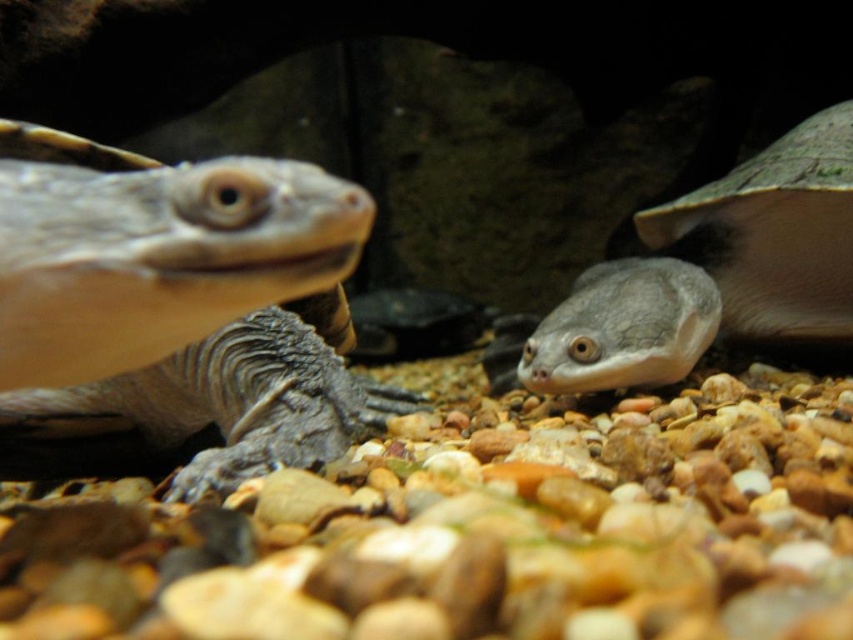
Question: Which object is positioned farthest from the smooth brown tortoise at left?

Choices:
 (A) smooth gray tortoise at center
 (B) matte gray tortoise at right

Answer: (B)

Question: Can you confirm if matte gray tortoise at right is positioned to the left of smooth gray tortoise at center?

Choices:
 (A) yes
 (B) no

Answer: (B)

Question: Which of the following is the farthest from the observer?

Choices:
 (A) smooth gray tortoise at center
 (B) matte gray tortoise at right

Answer: (B)

Question: Does smooth brown tortoise at left have a lesser width compared to matte gray tortoise at right?

Choices:
 (A) yes
 (B) no

Answer: (A)

Question: Is smooth brown tortoise at left below smooth gray tortoise at center?

Choices:
 (A) yes
 (B) no

Answer: (B)

Question: Which is farther from the matte gray tortoise at right?

Choices:
 (A) smooth gray tortoise at center
 (B) smooth brown tortoise at left

Answer: (B)